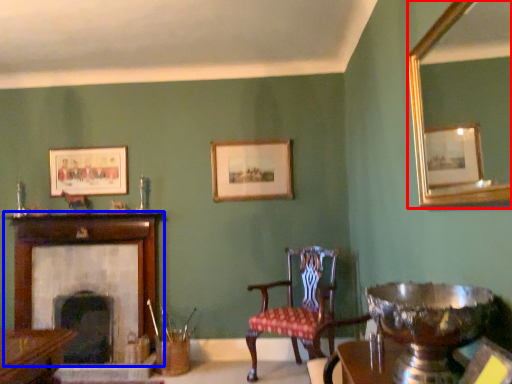
Question: Which object is further to the camera taking this photo, mirror (highlighted by a red box) or fireplace (highlighted by a blue box)?

Choices:
 (A) mirror
 (B) fireplace

Answer: (B)